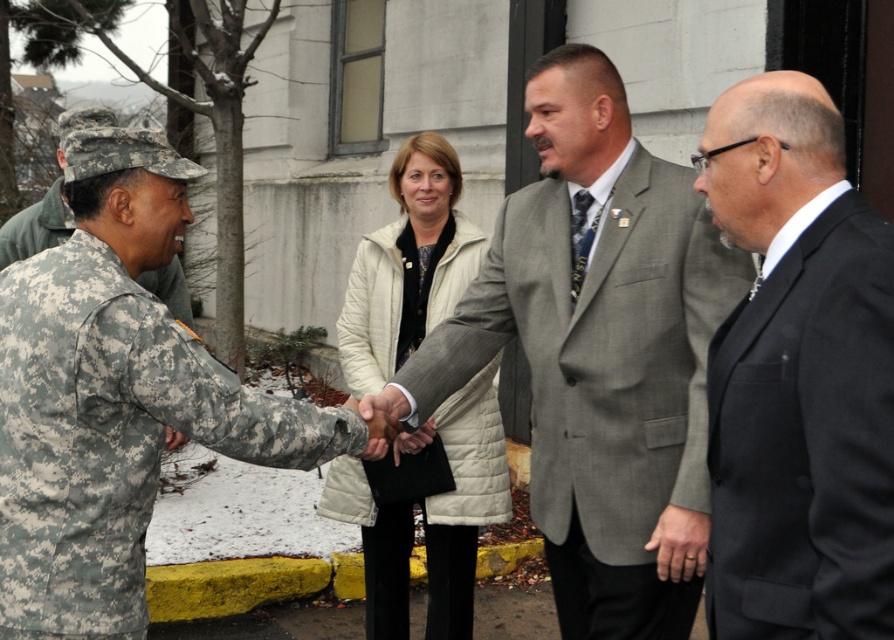
Question: Where is gray textured suit at center located in relation to camouflage fabric uniform at left in the image?

Choices:
 (A) above
 (B) below

Answer: (B)

Question: Among these points, which one is farthest from the camera?

Choices:
 (A) (540, 202)
 (B) (57, 385)

Answer: (A)

Question: Does gray textured suit at center have a smaller size compared to camouflage fabric uniform at left?

Choices:
 (A) yes
 (B) no

Answer: (B)

Question: Estimate the real-world distances between objects in this image. Which object is closer to the gray textured suit at center?

Choices:
 (A) camouflage uniform at left
 (B) light beige quilted jacket at center
 (C) black matte suit at right
 (D) camouflage fabric uniform at left

Answer: (D)

Question: Can you confirm if light beige quilted jacket at center is positioned to the left of camouflage uniform at left?

Choices:
 (A) yes
 (B) no

Answer: (B)

Question: Which of these objects is positioned farthest from the camouflage fabric uniform at left?

Choices:
 (A) gray textured suit at center
 (B) black matte suit at right

Answer: (B)